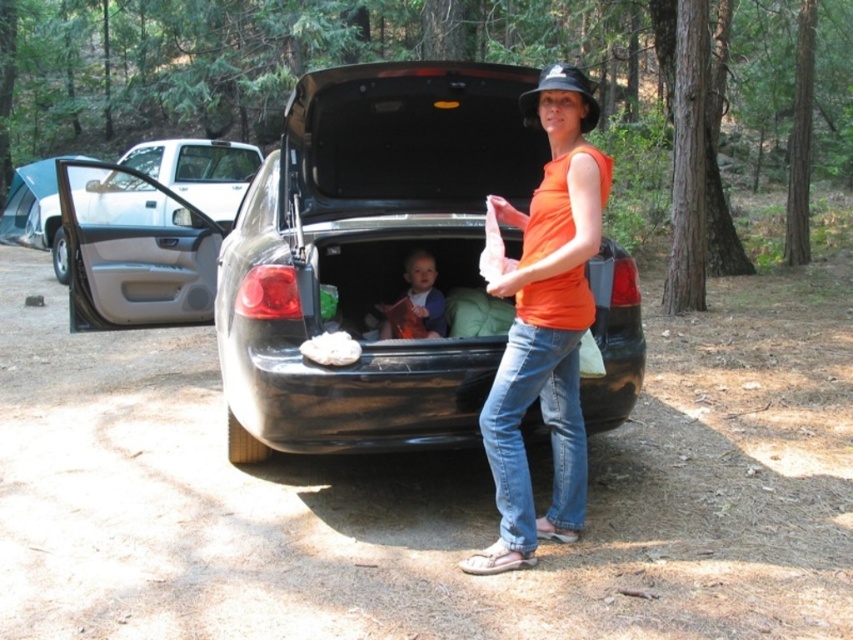
Question: Considering the real-world distances, which object is farthest from the smooth plastic book at center?

Choices:
 (A) orange cotton tank top at center
 (B) shiny black car at center

Answer: (A)

Question: Which object is farther from the camera taking this photo?

Choices:
 (A) shiny black car at center
 (B) orange cotton tank top at center

Answer: (A)

Question: Is shiny black car at center below orange cotton tank top at center?

Choices:
 (A) no
 (B) yes

Answer: (A)

Question: Is shiny black car at center to the left of orange cotton tank top at center from the viewer's perspective?

Choices:
 (A) no
 (B) yes

Answer: (B)

Question: Considering the real-world distances, which object is closest to the orange cotton tank top at center?

Choices:
 (A) shiny black car at center
 (B) smooth plastic book at center

Answer: (A)

Question: Can you confirm if shiny black car at center is smaller than smooth plastic book at center?

Choices:
 (A) yes
 (B) no

Answer: (B)